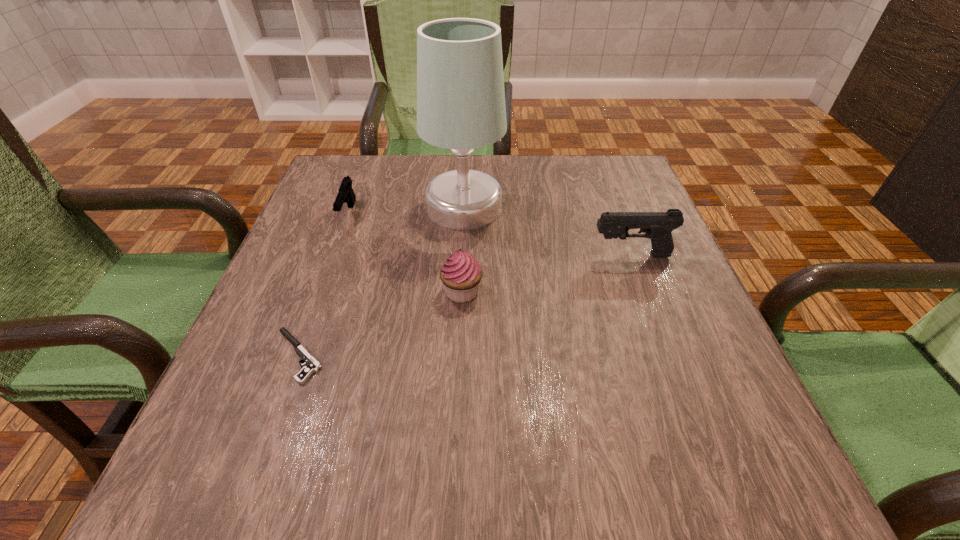
Locate an element on the screen. The height and width of the screenshot is (540, 960). vacant position at the left edge of the desktop is located at coordinates (253, 359).

The image size is (960, 540). I want to click on vacant position at the right edge of the desktop, so tap(693, 355).

This screenshot has width=960, height=540. I want to click on free space between the nearest pistol and the second tallest pistol, so click(324, 285).

Find the location of `vacant area that lies between the lampshade and the rightmost pistol`. vacant area that lies between the lampshade and the rightmost pistol is located at coordinates (547, 231).

Locate an element on the screen. vacant area that lies between the nearest pistol and the lampshade is located at coordinates (381, 281).

Where is `blank region between the cupcake and the farthest pistol`? blank region between the cupcake and the farthest pistol is located at coordinates (405, 253).

The image size is (960, 540). In order to click on vacant point located between the fourth farthest object and the tallest object in this screenshot , I will do `click(463, 249)`.

You are a GUI agent. You are given a task and a screenshot of the screen. Output one action in this format:
    pyautogui.click(x=<x>, y=<y>)
    Task: Click on the vacant space that's between the lampshade and the cupcake
    
    Given the screenshot: What is the action you would take?
    pyautogui.click(x=463, y=249)

Identify the location of unoccupied area between the cupcake and the farthest pistol. (405, 253).

I want to click on blank region between the nearest pistol and the tallest object, so click(381, 281).